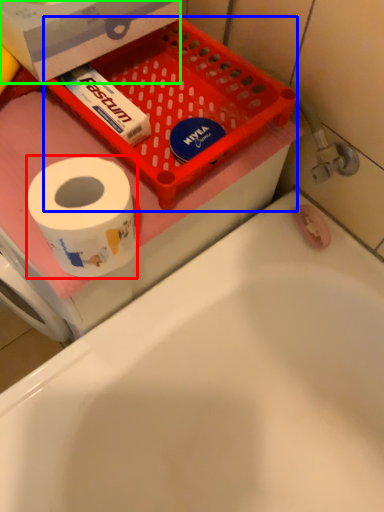
Question: Which is farther away from toilet paper (highlighted by a red box)? basket (highlighted by a blue box) or box (highlighted by a green box)?

Choices:
 (A) basket
 (B) box

Answer: (B)